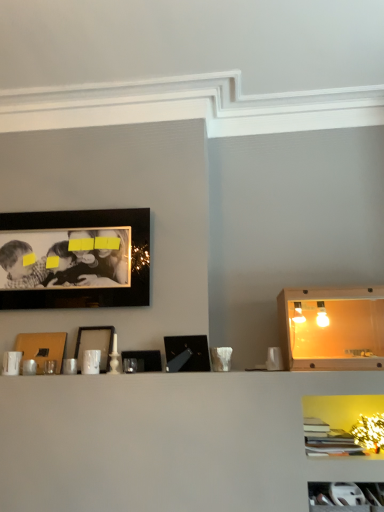
This screenshot has height=512, width=384. I want to click on white plastic cabinet at lower right, the 1th cabinet viewed from the front, so [346, 497].

Identify the location of black matte picture frame at upper left, which is the 2th picture frame in left-to-right order. (75, 259).

Find the location of a particular element. The image size is (384, 512). black glossy picture frame at center, which ranks as the 5th picture frame in left-to-right order is located at coordinates (191, 349).

From the image's perspective, is black matte picture frame at upper left, which is the 2th picture frame in left-to-right order, beneath black matte picture frame at center, which is the 4th picture frame from left to right?

No, from the image's perspective, black matte picture frame at upper left, which is the 2th picture frame in left-to-right order, is not beneath black matte picture frame at center, which is the 4th picture frame from left to right.

Can you tell me how much black matte picture frame at upper left, marked as the fourth picture frame in a right-to-left arrangement, and black matte picture frame at center, which is the 4th picture frame from left to right, differ in facing direction?

There is a 179-degree angle between the facing directions of black matte picture frame at upper left, marked as the fourth picture frame in a right-to-left arrangement, and black matte picture frame at center, which is the 4th picture frame from left to right.

Considering the sizes of objects black matte picture frame at upper left, which is the 2th picture frame in left-to-right order, and black matte picture frame at center, which is counted as the 2th picture frame, starting from the right, in the image provided, who is smaller, black matte picture frame at upper left, which is the 2th picture frame in left-to-right order, or black matte picture frame at center, which is counted as the 2th picture frame, starting from the right,?

black matte picture frame at center, which is counted as the 2th picture frame, starting from the right, is smaller.

Does black matte picture frame at upper left, which is the 2th picture frame in left-to-right order, contain black matte picture frame at center, which is counted as the 2th picture frame, starting from the right?

No, black matte picture frame at upper left, which is the 2th picture frame in left-to-right order, does not contain black matte picture frame at center, which is counted as the 2th picture frame, starting from the right.

Does matte brown picture frame at center-left, which ranks as the 5th picture frame in right-to-left order, touch black matte picture frame at center, which is counted as the 2th picture frame, starting from the right?

There is a gap between matte brown picture frame at center-left, which ranks as the 5th picture frame in right-to-left order, and black matte picture frame at center, which is counted as the 2th picture frame, starting from the right.

Considering the sizes of objects matte brown picture frame at center-left, which ranks as the 5th picture frame in right-to-left order, and black matte picture frame at center, which is the 4th picture frame from left to right, in the image provided, who is bigger, matte brown picture frame at center-left, which ranks as the 5th picture frame in right-to-left order, or black matte picture frame at center, which is the 4th picture frame from left to right,?

matte brown picture frame at center-left, which ranks as the 5th picture frame in right-to-left order.

You are a GUI agent. You are given a task and a screenshot of the screen. Output one action in this format:
    pyautogui.click(x=<x>, y=<y>)
    Task: Click on the picture frame below the matte brown picture frame at center-left, the first picture frame from the left (from the image's perspective)
    
    Given the screenshot: What is the action you would take?
    pyautogui.click(x=144, y=359)

Considering the positions of points (59, 338) and (143, 351), is point (59, 338) closer to camera compared to point (143, 351)?

No, it is not.

Considering the positions of point (382, 331) and point (137, 352), is point (382, 331) closer or farther from the camera than point (137, 352)?

Point (382, 331) appears to be farther away from the viewer than point (137, 352).

This screenshot has width=384, height=512. In order to click on the 1st cabinet in front of the black matte picture frame at center, which is counted as the 2th picture frame, starting from the right in this screenshot , I will do `click(332, 328)`.

Looking at the image, does wooden cabinet at right, the second cabinet viewed from the front, seem bigger or smaller compared to black matte picture frame at center, which is the 4th picture frame from left to right?

wooden cabinet at right, the second cabinet viewed from the front, is bigger than black matte picture frame at center, which is the 4th picture frame from left to right.

How far apart are wooden cabinet at right, which is the 1th cabinet in top-to-bottom order, and matte black picture frame at center, arranged as the third picture frame when viewed from the left?

They are 3.95 feet apart.

Is point (307, 358) in front of point (110, 341)?

Yes, it is.

Which of these two, wooden cabinet at right, arranged as the 1th cabinet when viewed from the back, or matte black picture frame at center, arranged as the third picture frame when viewed from the left, is wider?

wooden cabinet at right, arranged as the 1th cabinet when viewed from the back, is wider.

From the matte black picture frame at center, which is the third picture frame in right-to-left order, count 1st cabinets forward and point to it. Please provide its 2D coordinates.

[(332, 328)]

Considering the relative sizes of white plastic cabinet at lower right, arranged as the 2th cabinet when viewed from the top, and wooden cabinet at right, arranged as the 1th cabinet when viewed from the back, in the image provided, is white plastic cabinet at lower right, arranged as the 2th cabinet when viewed from the top, shorter than wooden cabinet at right, arranged as the 1th cabinet when viewed from the back,?

Indeed, white plastic cabinet at lower right, arranged as the 2th cabinet when viewed from the top, has a lesser height compared to wooden cabinet at right, arranged as the 1th cabinet when viewed from the back.

How many degrees apart are the facing directions of white plastic cabinet at lower right, arranged as the 2th cabinet when viewed from the top, and wooden cabinet at right, which is the 1th cabinet in top-to-bottom order?

The angle between the facing direction of white plastic cabinet at lower right, arranged as the 2th cabinet when viewed from the top, and the facing direction of wooden cabinet at right, which is the 1th cabinet in top-to-bottom order, is 4.43 degrees.

Is white plastic cabinet at lower right, the second cabinet viewed from the back, facing away from wooden cabinet at right, the second cabinet viewed from the front?

That's not correct — white plastic cabinet at lower right, the second cabinet viewed from the back, is not looking away from wooden cabinet at right, the second cabinet viewed from the front.

Is point (328, 490) more distant than point (374, 368)?

No.

Is matte brown picture frame at center-left, the first picture frame from the left, with black glossy picture frame at center, which ranks as the 5th picture frame in left-to-right order?

No.

From the image's perspective, relative to black glossy picture frame at center, which ranks as the 5th picture frame in left-to-right order, is matte brown picture frame at center-left, the first picture frame from the left, above or below?

Clearly, from the image's perspective, matte brown picture frame at center-left, the first picture frame from the left, is below black glossy picture frame at center, which ranks as the 5th picture frame in left-to-right order.

Consider the image. Considering the relative positions of matte brown picture frame at center-left, the first picture frame from the left, and black glossy picture frame at center, the 1th picture frame from the right, in the image provided, is matte brown picture frame at center-left, the first picture frame from the left, to the left of black glossy picture frame at center, the 1th picture frame from the right, from the viewer's perspective?

Correct, you'll find matte brown picture frame at center-left, the first picture frame from the left, to the left of black glossy picture frame at center, the 1th picture frame from the right.

Is matte brown picture frame at center-left, the first picture frame from the left, closer to the viewer compared to black glossy picture frame at center, the 1th picture frame from the right?

No, the depth of matte brown picture frame at center-left, the first picture frame from the left, is greater than that of black glossy picture frame at center, the 1th picture frame from the right.

Is black glossy picture frame at center, the 1th picture frame from the right, completely or partially outside of black matte picture frame at upper left, which is the 2th picture frame in left-to-right order?

black glossy picture frame at center, the 1th picture frame from the right, lies outside black matte picture frame at upper left, which is the 2th picture frame in left-to-right order,'s area.

Between black glossy picture frame at center, the 1th picture frame from the right, and black matte picture frame at upper left, marked as the fourth picture frame in a right-to-left arrangement, which one is positioned behind?

black matte picture frame at upper left, marked as the fourth picture frame in a right-to-left arrangement, is behind.

Is black glossy picture frame at center, the 1th picture frame from the right, oriented away from black matte picture frame at upper left, marked as the fourth picture frame in a right-to-left arrangement?

No, black glossy picture frame at center, the 1th picture frame from the right, is not facing the opposite direction of black matte picture frame at upper left, marked as the fourth picture frame in a right-to-left arrangement.

Looking at this image, from the image's perspective, between black glossy picture frame at center, the 1th picture frame from the right, and black matte picture frame at upper left, marked as the fourth picture frame in a right-to-left arrangement, which one is located above?

From the image's view, black matte picture frame at upper left, marked as the fourth picture frame in a right-to-left arrangement, is above.

From a real-world perspective, count 4th picture frames upward from the black matte picture frame at center, which is the 4th picture frame from left to right, and point to it. Please provide its 2D coordinates.

[(75, 259)]

Identify the location of the 1st picture frame above the black matte picture frame at center, which is the 4th picture frame from left to right (from the image's perspective). (42, 349).

Based on their spatial positions, is black matte picture frame at upper left, marked as the fourth picture frame in a right-to-left arrangement, or black matte picture frame at center, which is counted as the 2th picture frame, starting from the right, further from white plastic cabinet at lower right, the 1th cabinet viewed from the front?

black matte picture frame at upper left, marked as the fourth picture frame in a right-to-left arrangement, is positioned further to the anchor white plastic cabinet at lower right, the 1th cabinet viewed from the front.

Based on their spatial positions, is black matte picture frame at center, which is the 4th picture frame from left to right, or matte brown picture frame at center-left, the first picture frame from the left, further from wooden cabinet at right, which is the 1th cabinet in top-to-bottom order?

Based on the image, matte brown picture frame at center-left, the first picture frame from the left, appears to be further to wooden cabinet at right, which is the 1th cabinet in top-to-bottom order.

Based on their spatial positions, is matte brown picture frame at center-left, the first picture frame from the left, or black matte picture frame at upper left, marked as the fourth picture frame in a right-to-left arrangement, closer to matte black picture frame at center, arranged as the third picture frame when viewed from the left?

The object closer to matte black picture frame at center, arranged as the third picture frame when viewed from the left, is matte brown picture frame at center-left, the first picture frame from the left.

Based on their spatial positions, is wooden cabinet at right, arranged as the 1th cabinet when viewed from the back, or black matte picture frame at center, which is the 4th picture frame from left to right, closer to white plastic cabinet at lower right, the 1th cabinet viewed from the front?

Among the two, wooden cabinet at right, arranged as the 1th cabinet when viewed from the back, is located nearer to white plastic cabinet at lower right, the 1th cabinet viewed from the front.

Considering their positions, is matte black picture frame at center, arranged as the third picture frame when viewed from the left, positioned further to white plastic cabinet at lower right, the 1th cabinet in the bottom-to-top sequence, than black glossy picture frame at center, which ranks as the 5th picture frame in left-to-right order?

The object further to white plastic cabinet at lower right, the 1th cabinet in the bottom-to-top sequence, is matte black picture frame at center, arranged as the third picture frame when viewed from the left.

Looking at the image, which one is located closer to matte brown picture frame at center-left, the first picture frame from the left, black matte picture frame at upper left, which is the 2th picture frame in left-to-right order, or black glossy picture frame at center, which ranks as the 5th picture frame in left-to-right order?

The object closer to matte brown picture frame at center-left, the first picture frame from the left, is black matte picture frame at upper left, which is the 2th picture frame in left-to-right order.

Based on their spatial positions, is matte black picture frame at center, which is the third picture frame in right-to-left order, or white plastic cabinet at lower right, the second cabinet viewed from the back, closer to black matte picture frame at center, which is counted as the 2th picture frame, starting from the right?

Among the two, matte black picture frame at center, which is the third picture frame in right-to-left order, is located nearer to black matte picture frame at center, which is counted as the 2th picture frame, starting from the right.

Which object lies nearer to the anchor point black matte picture frame at upper left, marked as the fourth picture frame in a right-to-left arrangement, wooden cabinet at right, the second cabinet positioned from the bottom, or white plastic cabinet at lower right, the 1th cabinet in the bottom-to-top sequence?

Among the two, wooden cabinet at right, the second cabinet positioned from the bottom, is located nearer to black matte picture frame at upper left, marked as the fourth picture frame in a right-to-left arrangement.

In order to click on picture frame located between matte black picture frame at center, which is the third picture frame in right-to-left order, and black glossy picture frame at center, the 1th picture frame from the right, in the left-right direction in this screenshot , I will do `click(144, 359)`.

Identify the location of cabinet between matte black picture frame at center, arranged as the third picture frame when viewed from the left, and wooden cabinet at right, the second cabinet viewed from the front, in the horizontal direction. (346, 497).

You are a GUI agent. You are given a task and a screenshot of the screen. Output one action in this format:
    pyautogui.click(x=<x>, y=<y>)
    Task: Click on the picture frame between black matte picture frame at center, which is counted as the 2th picture frame, starting from the right, and wooden cabinet at right, which is the 1th cabinet in top-to-bottom order
    The width and height of the screenshot is (384, 512).
    Given the screenshot: What is the action you would take?
    pyautogui.click(x=191, y=349)

Find the location of a particular element. The height and width of the screenshot is (512, 384). cabinet between black matte picture frame at upper left, marked as the fourth picture frame in a right-to-left arrangement, and wooden cabinet at right, arranged as the 1th cabinet when viewed from the back, in the horizontal direction is located at coordinates (346, 497).